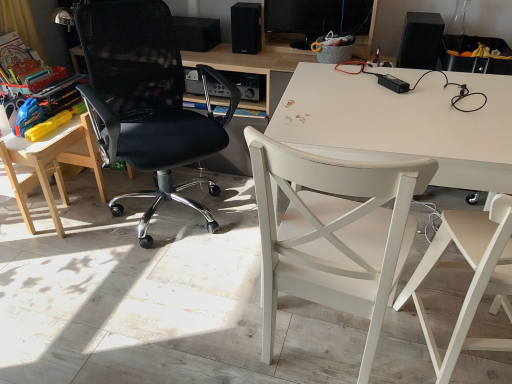
The image size is (512, 384). I want to click on vacant space in front of black mesh office chair at left, the second chair from the left, so click(148, 287).